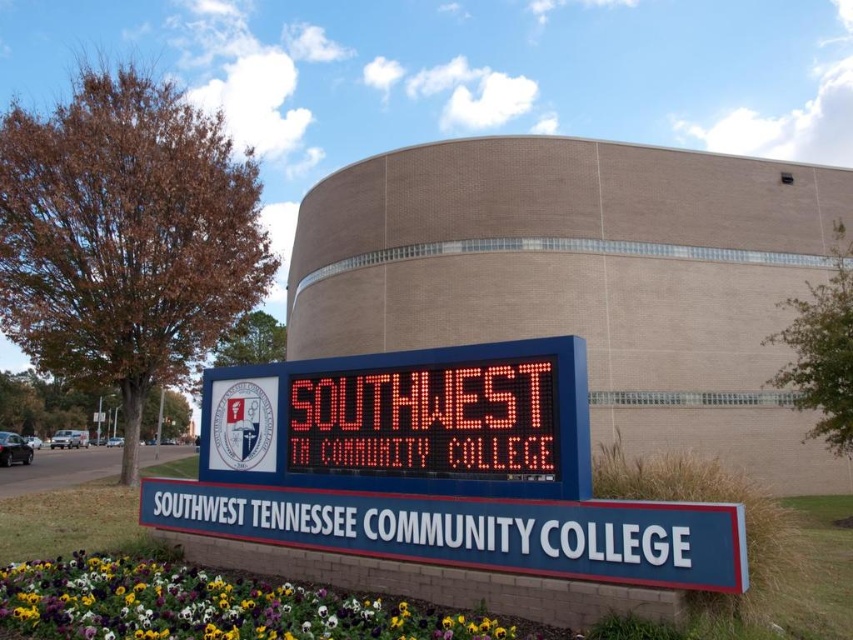
Question: Is multicolored petals at lower center closer to the viewer compared to led display at center?

Choices:
 (A) yes
 (B) no

Answer: (A)

Question: Does multicolored petals at lower center appear under led display at center?

Choices:
 (A) yes
 (B) no

Answer: (A)

Question: Is the position of multicolored petals at lower center less distant than that of led display at center?

Choices:
 (A) yes
 (B) no

Answer: (A)

Question: Which object appears farthest from the camera in this image?

Choices:
 (A) multicolored petals at lower center
 (B) led display at center

Answer: (B)